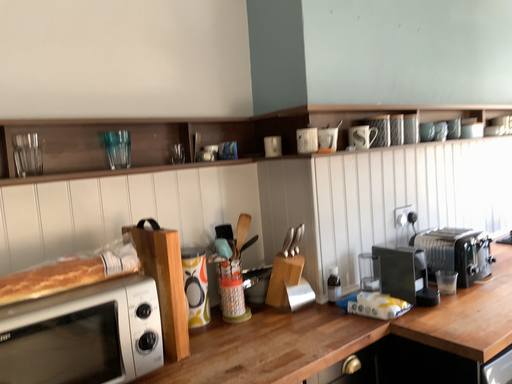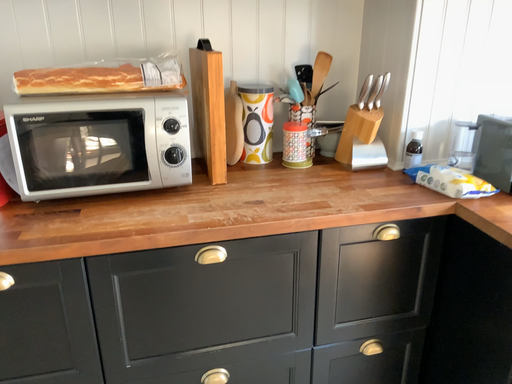
Question: How did the camera likely rotate when shooting the video?

Choices:
 (A) rotated upward
 (B) rotated downward

Answer: (B)